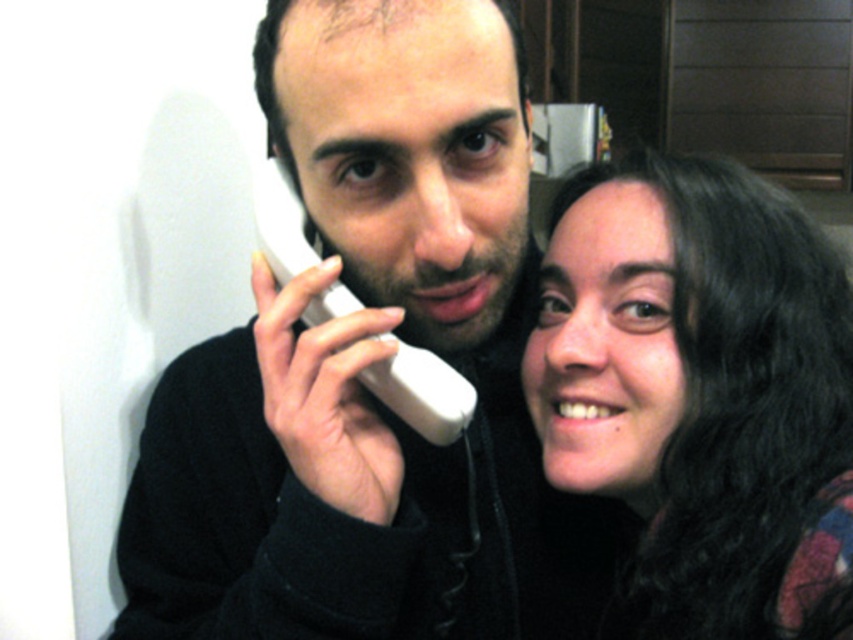
Question: Is smooth dark hair at right to the left of white plastic phone at center from the viewer's perspective?

Choices:
 (A) no
 (B) yes

Answer: (A)

Question: Which point appears closest to the camera in this image?

Choices:
 (A) (285, 186)
 (B) (666, 433)

Answer: (B)

Question: Is smooth dark hair at right below white plastic phone at center?

Choices:
 (A) yes
 (B) no

Answer: (A)

Question: Does smooth dark hair at right have a lesser width compared to white plastic phone at center?

Choices:
 (A) yes
 (B) no

Answer: (B)